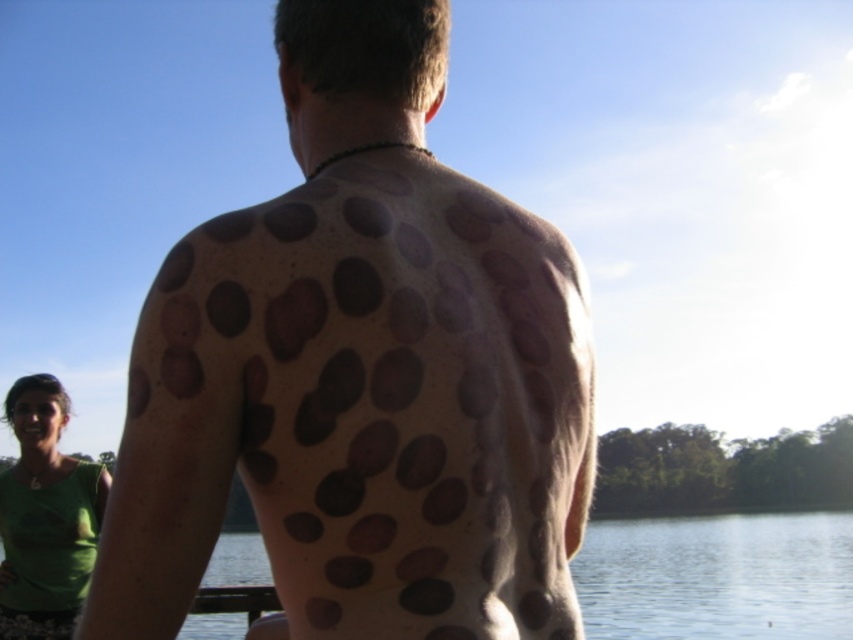
Is point (692, 525) farther from viewer compared to point (22, 385)?

Yes, it is.

Is transparent water at lower center smaller than green fabric shirt at lower left?

No.

What do you see at coordinates (717, 577) in the screenshot? This screenshot has width=853, height=640. I see `transparent water at lower center` at bounding box center [717, 577].

The width and height of the screenshot is (853, 640). I want to click on transparent water at lower center, so click(x=717, y=577).

Does brown textured spots at back appear on the right side of transparent water at lower center?

In fact, brown textured spots at back is to the left of transparent water at lower center.

Who is more distant from viewer, (144, 600) or (706, 598)?

The point (706, 598) is behind.

At what (x,y) coordinates should I click in order to perform the action: click on brown textured spots at back. Please return your answer as a coordinate pair (x, y). This screenshot has width=853, height=640. Looking at the image, I should click on (360, 372).

Which is more to the right, brown textured spots at back or green fabric shirt at lower left?

brown textured spots at back

Is brown textured spots at back to the left of green fabric shirt at lower left from the viewer's perspective?

No, brown textured spots at back is not to the left of green fabric shirt at lower left.

Which is behind, point (479, 545) or point (97, 500)?

The point (97, 500) is more distant.

At what (x,y) coordinates should I click in order to perform the action: click on brown textured spots at back. Please return your answer as a coordinate pair (x, y). This screenshot has height=640, width=853. Looking at the image, I should click on (360, 372).